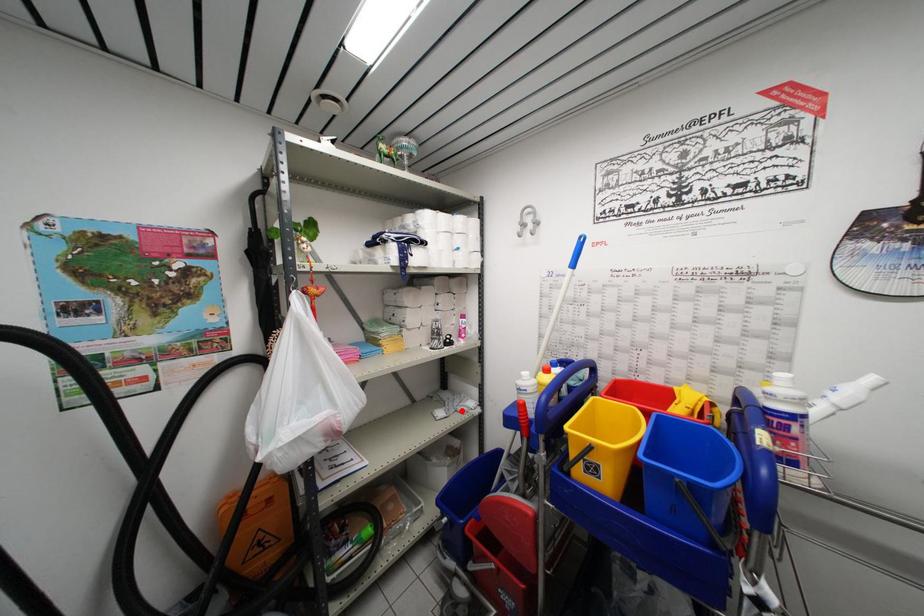
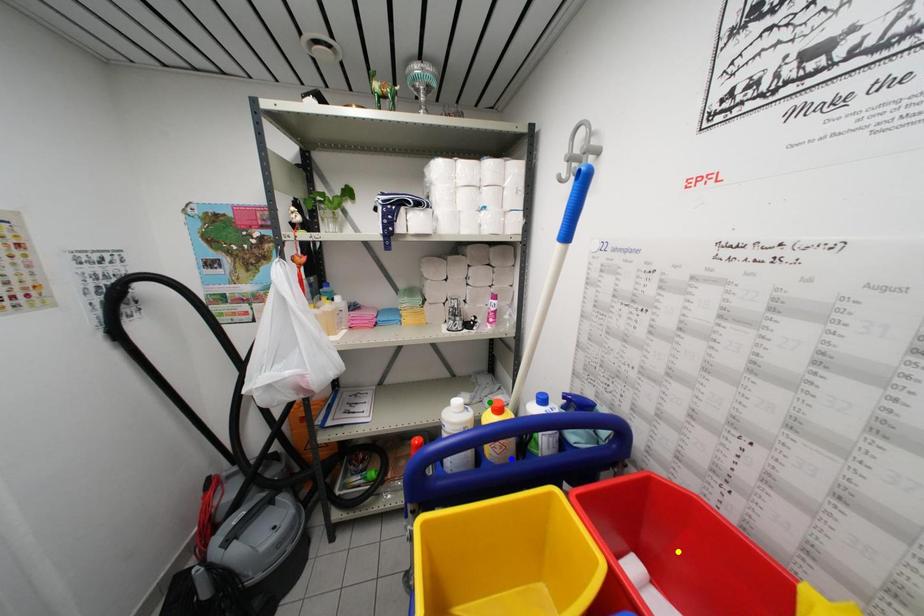
Question: I am providing you with two images of the same scene from different viewpoints. A red point is marked on the first image. You are given multiple points on the second image. Which point in image 2 represents the same 3d spot as the red point in image 1?

Choices:
 (A) yellow point
 (B) blue point
 (C) green point

Answer: (C)